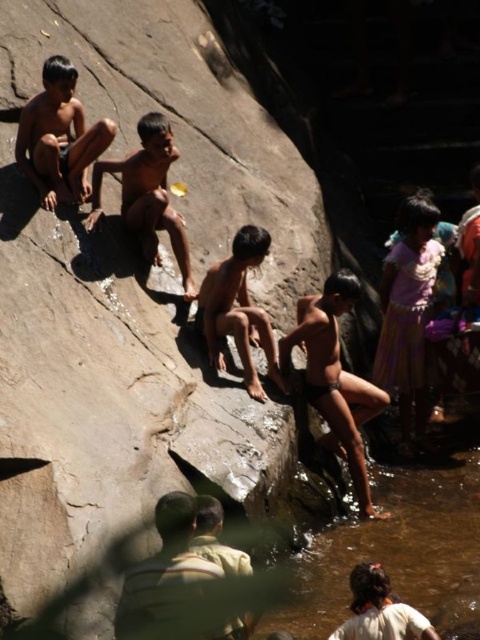
You are a photographer standing at the edge of the stream. You want to take a photo of the matte skin child at center and the brown skin boy at center. According to the scene description, which child is positioned lower in the image?

The matte skin child at center is positioned lower than the brown skin boy at center in the image.

You are a photographer standing at the edge of the riverbank. You want to capture a photo of the light brown skin boy at center and the pink fabric skirt at lower right in the same frame. Which object occupies more horizontal space in the image?

The light brown skin boy at center occupies more horizontal space in the image than the pink fabric skirt at lower right because the pink fabric skirt at lower right has a lesser width compared to light brown skin boy at center.